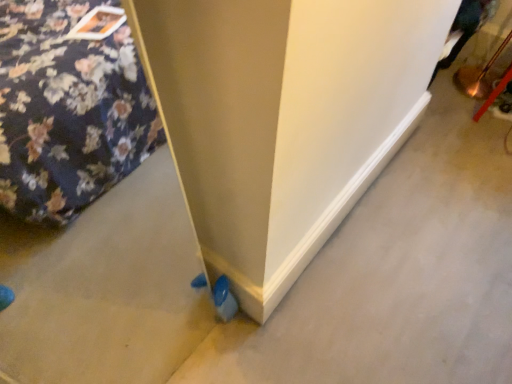
Locate an element on the screen. Image resolution: width=512 pixels, height=384 pixels. vacant region in front of blue rubber toy at lower center is located at coordinates (212, 354).